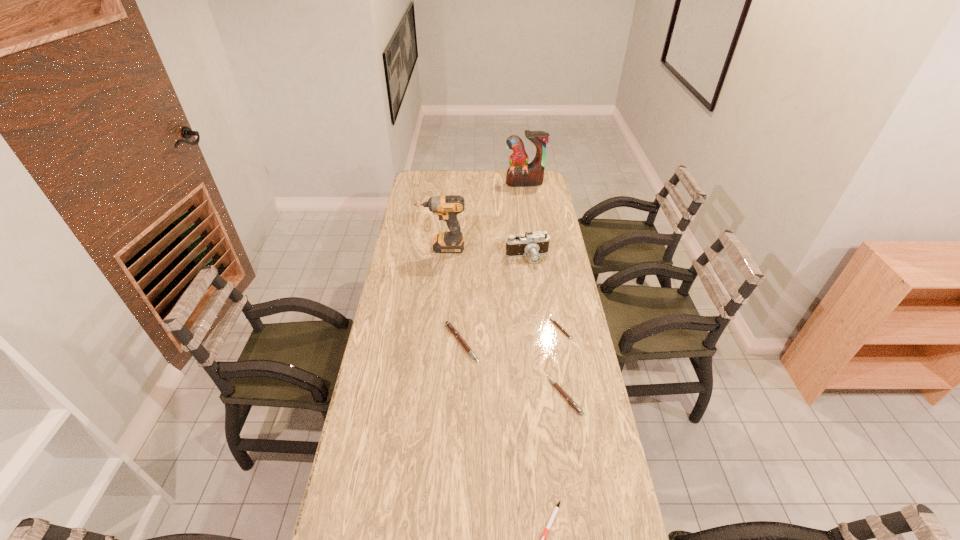
Where is `the farthest object`? the farthest object is located at coordinates (520, 174).

This screenshot has height=540, width=960. I want to click on drill, so [x=447, y=207].

The width and height of the screenshot is (960, 540). I want to click on the fifth shortest object, so click(x=533, y=244).

You are a GUI agent. You are given a task and a screenshot of the screen. Output one action in this format:
    pyautogui.click(x=<x>, y=<y>)
    Task: Click on the leftmost pen
    The height and width of the screenshot is (540, 960).
    Given the screenshot: What is the action you would take?
    pyautogui.click(x=448, y=324)

The width and height of the screenshot is (960, 540). I want to click on the tallest pen, so click(448, 324).

The width and height of the screenshot is (960, 540). I want to click on the sixth farthest object, so (x=571, y=402).

You are a GUI agent. You are given a task and a screenshot of the screen. Output one action in this format:
    pyautogui.click(x=<x>, y=<y>)
    Task: Click on the nearest pink pen
    
    Given the screenshot: What is the action you would take?
    pyautogui.click(x=571, y=402)

You are a GUI agent. You are given a task and a screenshot of the screen. Output one action in this format:
    pyautogui.click(x=<x>, y=<y>)
    Task: Click on the smallest pink pen
    This screenshot has height=540, width=960.
    Given the screenshot: What is the action you would take?
    pyautogui.click(x=563, y=330)

At what (x,y) coordinates should I click in order to perform the action: click on vacant space located at the face of the parrot. Please return your answer as a coordinate pair (x, y). The width and height of the screenshot is (960, 540). Looking at the image, I should click on (526, 194).

Locate an element on the screen. This screenshot has height=540, width=960. vacant space situated with the drill bit of the drill facing forward is located at coordinates (396, 247).